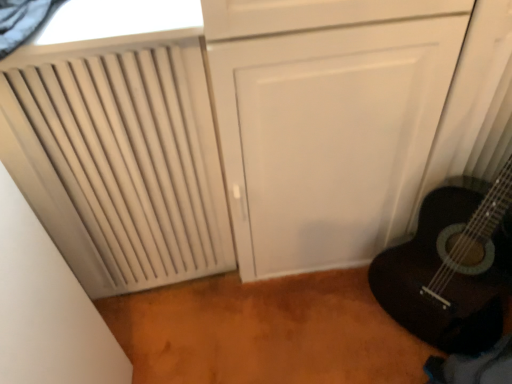
Locate an element on the screen. Image resolution: width=512 pixels, height=384 pixels. white textured window at upper left is located at coordinates (117, 19).

At what (x,y) coordinates should I click in order to perform the action: click on beige matte radiator at left. Please return your answer as a coordinate pair (x, y). Looking at the image, I should click on (120, 159).

The image size is (512, 384). I want to click on black mesh curtain at upper left, so click(22, 21).

Which is nearer, (6, 17) or (160, 112)?

Point (6, 17) appears to be closer to the viewer than point (160, 112).

From the image's perspective, between black mesh curtain at upper left and beige matte radiator at left, who is located below?

beige matte radiator at left.

From the picture: Could you tell me if black mesh curtain at upper left is facing beige matte radiator at left?

No, black mesh curtain at upper left does not turn towards beige matte radiator at left.

Considering the positions of objects white textured window at upper left and black mesh curtain at upper left in the image provided, who is more to the left, white textured window at upper left or black mesh curtain at upper left?

Positioned to the left is black mesh curtain at upper left.

Where is `window behind the black mesh curtain at upper left`? window behind the black mesh curtain at upper left is located at coordinates (117, 19).

Is white textured window at upper left next to black mesh curtain at upper left?

Yes.

Can black mesh curtain at upper left be found inside white textured window at upper left?

Actually, black mesh curtain at upper left is outside white textured window at upper left.

Are black mesh curtain at upper left and white textured window at upper left beside each other?

Yes, black mesh curtain at upper left is beside white textured window at upper left.

From the image's perspective, is black mesh curtain at upper left located beneath white textured window at upper left?

Yes.

Is white textured window at upper left at the back of black mesh curtain at upper left?

That's not correct — black mesh curtain at upper left is not looking away from white textured window at upper left.

Which is more to the left, black mesh curtain at upper left or white textured window at upper left?

black mesh curtain at upper left is more to the left.

Between point (184, 73) and point (10, 38), which one is positioned behind?

The point (184, 73) is farther from the camera.

Is beige matte radiator at left placed right next to black mesh curtain at upper left?

No, beige matte radiator at left is not in contact with black mesh curtain at upper left.

Which object is positioned more to the left, beige matte radiator at left or black mesh curtain at upper left?

beige matte radiator at left.

Is beige matte radiator at left thinner than black mesh curtain at upper left?

Indeed, beige matte radiator at left has a lesser width compared to black mesh curtain at upper left.

Who is bigger, white textured window at upper left or beige matte radiator at left?

beige matte radiator at left.

From their relative heights in the image, would you say white textured window at upper left is taller or shorter than beige matte radiator at left?

Considering their sizes, white textured window at upper left has less height than beige matte radiator at left.

At what (x,y) coordinates should I click in order to perform the action: click on window lying above the beige matte radiator at left (from the image's perspective). Please return your answer as a coordinate pair (x, y). This screenshot has height=384, width=512. Looking at the image, I should click on (117, 19).

Looking at this image, is white textured window at upper left positioned with its back to beige matte radiator at left?

That's not correct — white textured window at upper left is not looking away from beige matte radiator at left.

Locate an element on the screen. The width and height of the screenshot is (512, 384). window on the right of beige matte radiator at left is located at coordinates (117, 19).

Considering the sizes of objects beige matte radiator at left and white textured window at upper left in the image provided, who is wider, beige matte radiator at left or white textured window at upper left?

white textured window at upper left is wider.

Is beige matte radiator at left positioned behind white textured window at upper left?

No, beige matte radiator at left is closer to the camera.

How far apart are beige matte radiator at left and white textured window at upper left?

They are 12.22 inches apart.

Locate an element on the screen. The height and width of the screenshot is (384, 512). curtain on the right of the beige matte radiator at left is located at coordinates (22, 21).

In the image, there is a white textured window at upper left. Where is `curtain below it (from the image's perspective)`? The image size is (512, 384). curtain below it (from the image's perspective) is located at coordinates (22, 21).

From the image, which object appears to be farther from beige matte radiator at left, white textured window at upper left or black mesh curtain at upper left?

The object further to beige matte radiator at left is black mesh curtain at upper left.

Looking at the image, which one is located closer to white textured window at upper left, black mesh curtain at upper left or beige matte radiator at left?

black mesh curtain at upper left is positioned closer to the anchor white textured window at upper left.

Looking at the image, which one is located closer to black mesh curtain at upper left, white textured window at upper left or beige matte radiator at left?

white textured window at upper left lies closer to black mesh curtain at upper left than the other object.

Which object lies nearer to the anchor point black mesh curtain at upper left, beige matte radiator at left or white textured window at upper left?

white textured window at upper left.

From the image, which object appears to be farther from beige matte radiator at left, black mesh curtain at upper left or white textured window at upper left?

black mesh curtain at upper left lies further to beige matte radiator at left than the other object.

Looking at the image, which one is located further to white textured window at upper left, beige matte radiator at left or black mesh curtain at upper left?

Among the two, beige matte radiator at left is located further to white textured window at upper left.

Find the location of a particular element. The width and height of the screenshot is (512, 384). curtain between white textured window at upper left and beige matte radiator at left from top to bottom is located at coordinates (22, 21).